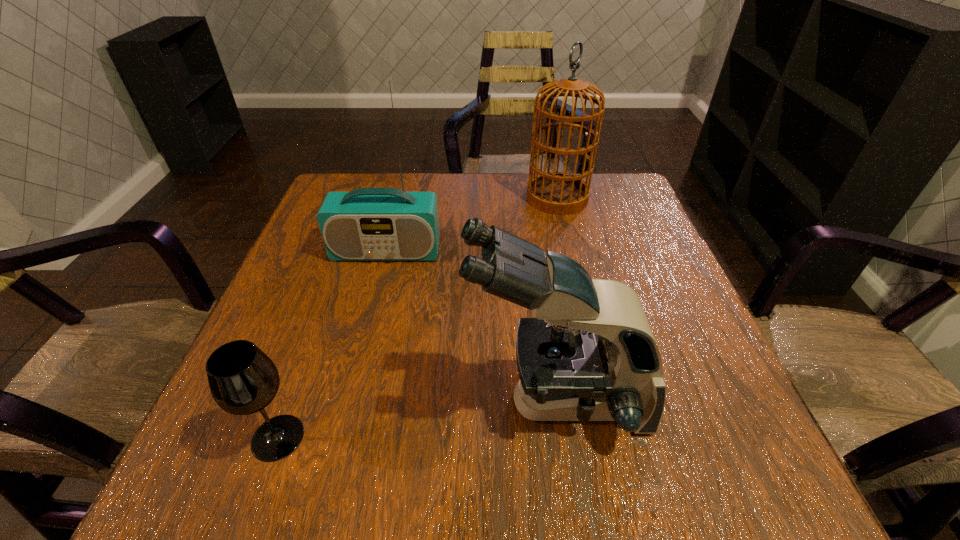
The width and height of the screenshot is (960, 540). I want to click on vacant region at the far edge of the desktop, so click(x=393, y=182).

The height and width of the screenshot is (540, 960). What are the coordinates of `vacant space at the near edge of the desktop` in the screenshot? It's located at (519, 454).

Find the location of `vacant area at the left edge`. vacant area at the left edge is located at coordinates (293, 267).

You are a GUI agent. You are given a task and a screenshot of the screen. Output one action in this format:
    pyautogui.click(x=<x>, y=<y>)
    Task: Click on the free location at the right edge
    The height and width of the screenshot is (540, 960).
    Given the screenshot: What is the action you would take?
    pyautogui.click(x=640, y=239)

At what (x,y) coordinates should I click in order to perform the action: click on free space at the far right corner of the desktop. Please return your answer as a coordinate pair (x, y). This screenshot has height=540, width=960. Looking at the image, I should click on (599, 201).

This screenshot has height=540, width=960. In the image, there is a desktop. Identify the location of vacant space at the near right corner. (708, 462).

Identify the location of free space between the birdcage and the wineglass. Image resolution: width=960 pixels, height=540 pixels. (418, 318).

This screenshot has height=540, width=960. What are the coordinates of `empty space that is in between the microscope and the shortest object` in the screenshot? It's located at (417, 419).

You are a GUI agent. You are given a task and a screenshot of the screen. Output one action in this format:
    pyautogui.click(x=<x>, y=<y>)
    Task: Click on the vacant area between the shortest object and the radio receiver
    This screenshot has width=960, height=540.
    Given the screenshot: What is the action you would take?
    pyautogui.click(x=332, y=345)

This screenshot has width=960, height=540. Find the location of `free spot between the microscope and the wineglass`. free spot between the microscope and the wineglass is located at coordinates (417, 419).